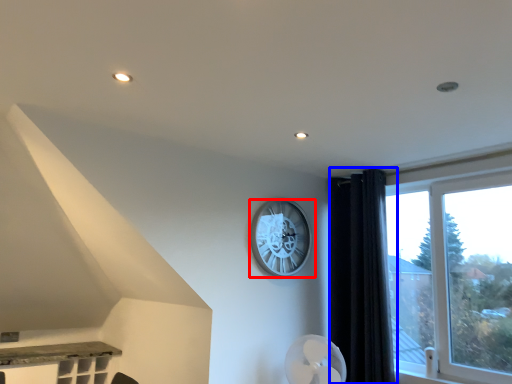
Question: Which point is further to the camera, wall clock (highlighted by a red box) or curtain (highlighted by a blue box)?

Choices:
 (A) wall clock
 (B) curtain

Answer: (A)